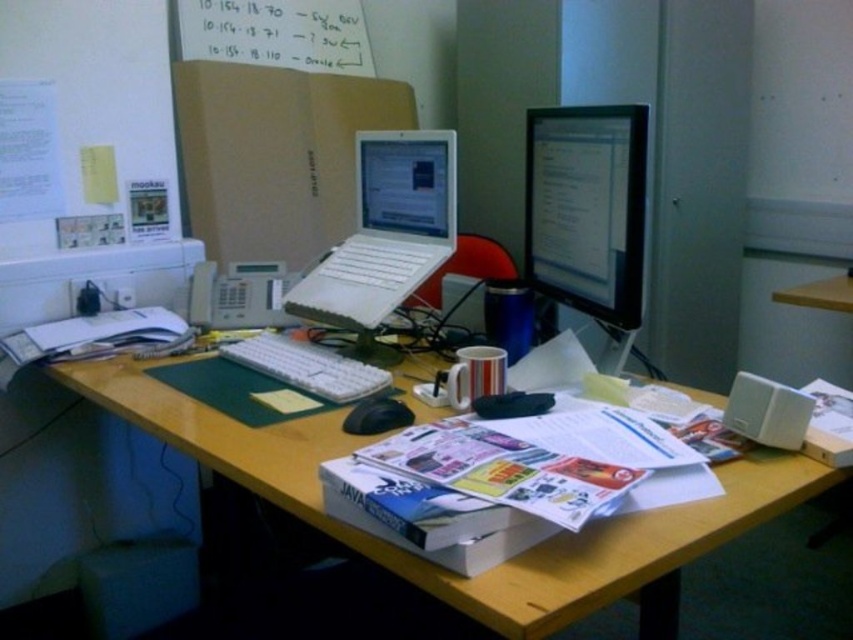
Is wooden at center bigger than white plastic laptop at center?

Correct, wooden at center is larger in size than white plastic laptop at center.

Does point (618, 588) come behind point (352, 285)?

That is False.

The width and height of the screenshot is (853, 640). Identify the location of wooden at center. (498, 564).

Which is more to the right, wooden at center or white paperboard at upper center?

Positioned to the right is wooden at center.

Can you confirm if wooden at center is positioned to the left of white paperboard at upper center?

Incorrect, wooden at center is not on the left side of white paperboard at upper center.

Is point (531, 625) more distant than point (252, 29)?

No, (531, 625) is closer to viewer.

Where is `wooden at center`? This screenshot has height=640, width=853. wooden at center is located at coordinates (498, 564).

Between wooden at center and white plastic keyboard at center, which one is positioned higher?

white plastic keyboard at center is higher up.

Does point (212, 433) come behind point (332, 388)?

No, it is in front of (332, 388).

At what (x,y) coordinates should I click in order to perform the action: click on wooden at center. Please return your answer as a coordinate pair (x, y). This screenshot has height=640, width=853. Looking at the image, I should click on (498, 564).